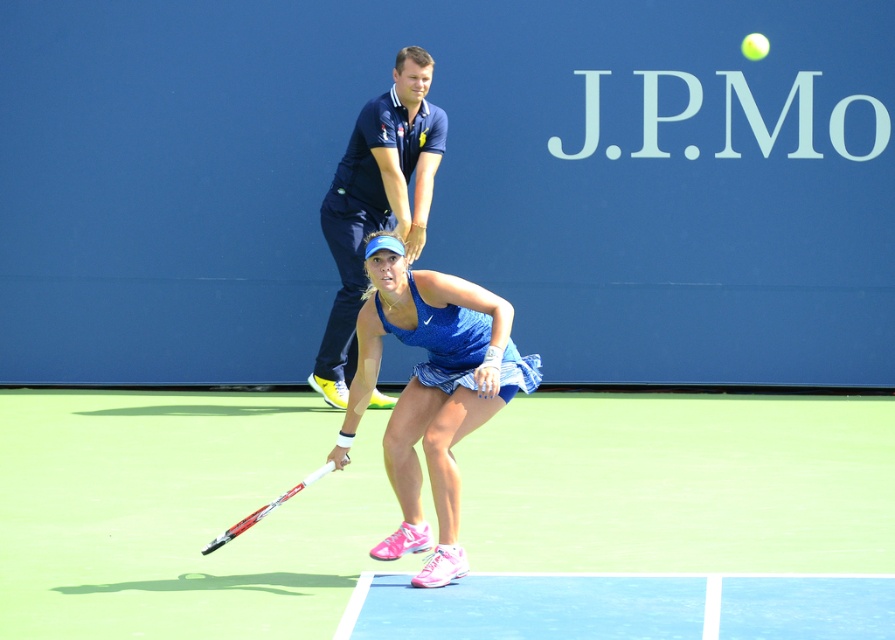
Which is above, green synthetic turf at center or blue fabric tennis skirt at center?

Positioned higher is blue fabric tennis skirt at center.

Between green synthetic turf at center and blue fabric tennis skirt at center, which one appears on the left side from the viewer's perspective?

blue fabric tennis skirt at center

Which is in front, point (806, 528) or point (418, 465)?

Point (418, 465) is in front.

This screenshot has height=640, width=895. What are the coordinates of `green synthetic turf at center` in the screenshot? It's located at (180, 515).

Can you confirm if blue fabric tennis skirt at center is positioned to the left of white matte tennis racket at center?

Incorrect, blue fabric tennis skirt at center is not on the left side of white matte tennis racket at center.

Does blue fabric tennis skirt at center lie in front of white matte tennis racket at center?

Yes, it is.

Where is `blue fabric tennis skirt at center`? blue fabric tennis skirt at center is located at coordinates (431, 392).

Between green synthetic turf at center and dark blue uniform at upper center, which one has less height?

green synthetic turf at center

Who is more distant from viewer, (84, 497) or (337, 358)?

Positioned behind is point (337, 358).

Between point (235, 547) and point (416, 161), which one is positioned behind?

Point (416, 161)

Find the location of `green synthetic turf at center`. green synthetic turf at center is located at coordinates (180, 515).